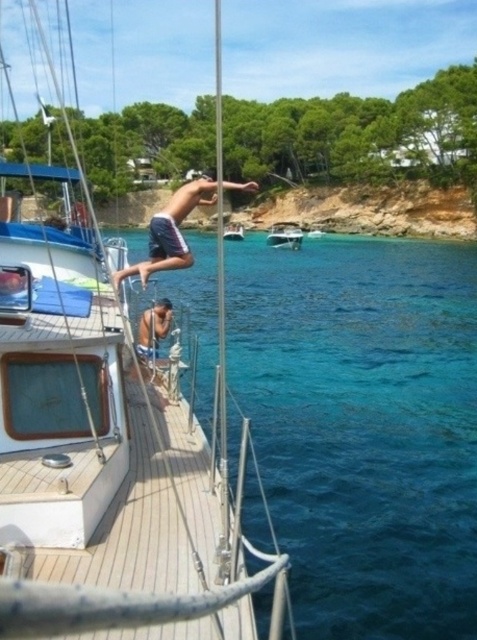
You are a photographer trying to capture the perfect shot of the dark blue shorts at center and the white glossy boat at center. Based on their sizes in the image, which object should you focus on first to ensure it fits entirely within your camera frame?

The dark blue shorts at center is larger in size than the white glossy boat at center, so you should focus on capturing the dark blue shorts at center first to ensure it fits entirely within your camera frame.

You are standing on the deck of the sailboat and want to take a photo of the point at coordinates point (x=469, y=556). If your camera has a maximum range of 8 meters, will you be able to capture the point in your photo?

The point (x=469, y=556) is 8.13 meters away from the camera, which exceeds the camera maximum range of 8 meters. Therefore, you cannot capture the point in your photo.